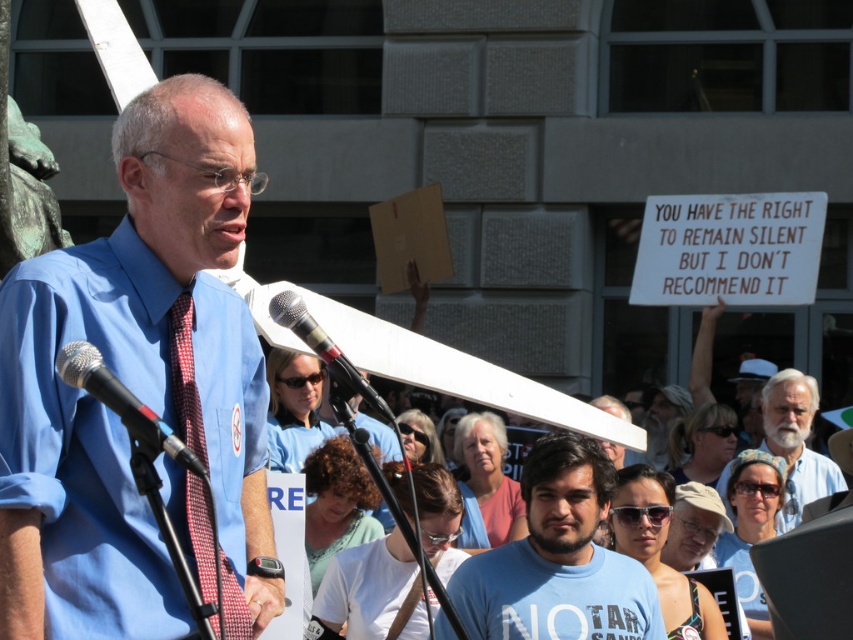
Is the position of matte blue shirt at center more distant than that of blue t-shirt at center?

That is False.

Locate an element on the screen. The height and width of the screenshot is (640, 853). matte blue shirt at center is located at coordinates (138, 385).

The width and height of the screenshot is (853, 640). Describe the element at coordinates (138, 385) in the screenshot. I see `matte blue shirt at center` at that location.

Image resolution: width=853 pixels, height=640 pixels. I want to click on matte blue shirt at center, so click(x=138, y=385).

Is blue cotton shirt at center thinner than red checkered tie at center?

No.

From the picture: Does blue cotton shirt at center have a lesser height compared to red checkered tie at center?

Yes, blue cotton shirt at center is shorter than red checkered tie at center.

I want to click on blue cotton shirt at center, so click(x=558, y=560).

Is point (775, 444) more distant than point (271, 300)?

Yes, it is behind point (271, 300).

Based on the photo, does white beard at center lie in front of silver metallic microphone at center?

No, white beard at center is behind silver metallic microphone at center.

Is point (790, 477) positioned in front of point (352, 392)?

No.

Locate an element on the screen. white beard at center is located at coordinates (795, 442).